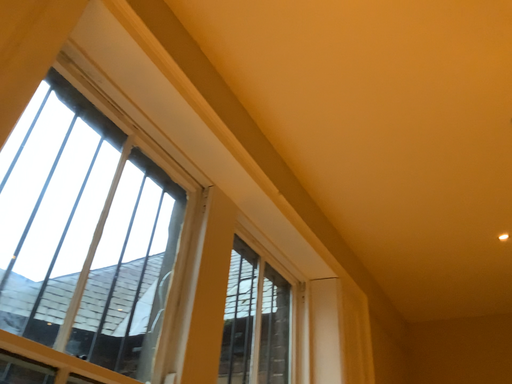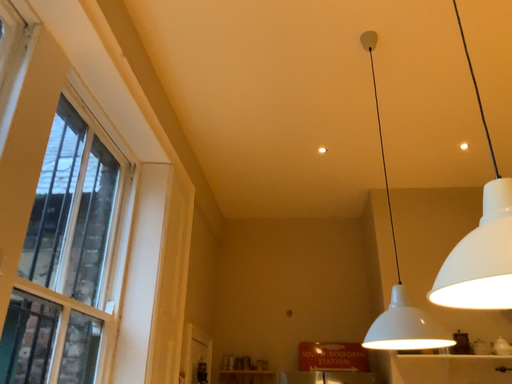
Question: Which way did the camera rotate in the video?

Choices:
 (A) rotated downward
 (B) rotated upward

Answer: (A)